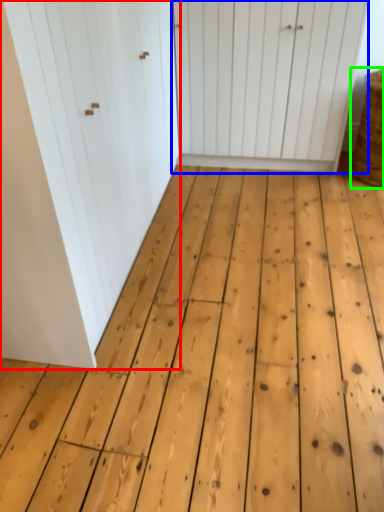
Question: Considering the real-world distances, which object is closest to door (highlighted by a red box)? door (highlighted by a blue box) or basket (highlighted by a green box).

Choices:
 (A) door
 (B) basket

Answer: (A)